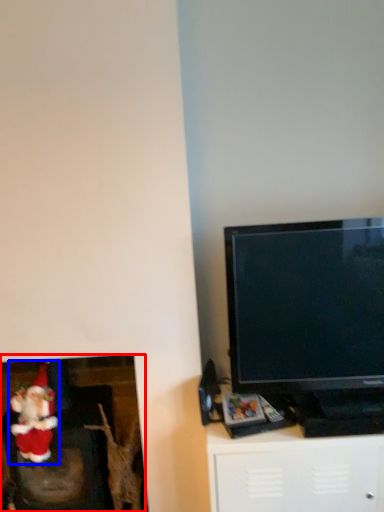
Question: Which object is closer to the camera taking this photo, fireplace (highlighted by a red box) or santa claus (highlighted by a blue box)?

Choices:
 (A) fireplace
 (B) santa claus

Answer: (B)